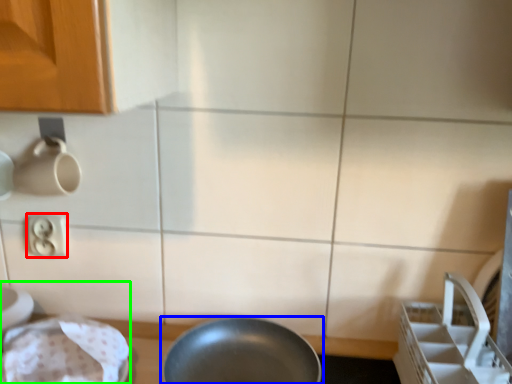
Question: Which object is the closest to the electric outlet (highlighted by a red box)? Choose among these: frying pan (highlighted by a blue box) or sink (highlighted by a green box).

Choices:
 (A) frying pan
 (B) sink

Answer: (B)